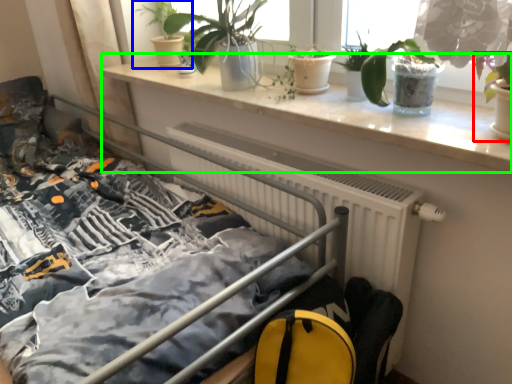
Question: Which object is the farthest from houseplant (highlighted by a red box)? Choose among these: houseplant (highlighted by a blue box) or window sill (highlighted by a green box).

Choices:
 (A) houseplant
 (B) window sill

Answer: (A)